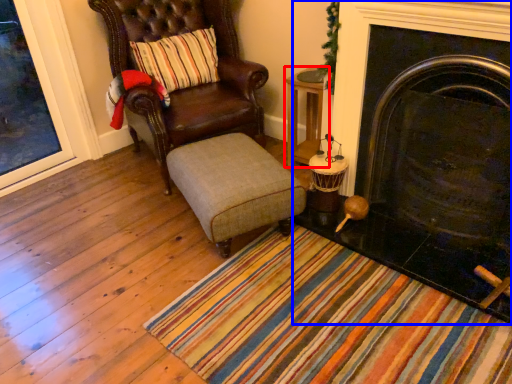
Question: Among these objects, which one is nearest to the camera, table (highlighted by a red box) or fireplace (highlighted by a blue box)?

Choices:
 (A) table
 (B) fireplace

Answer: (B)